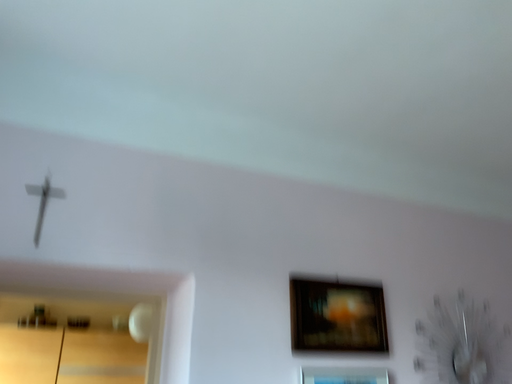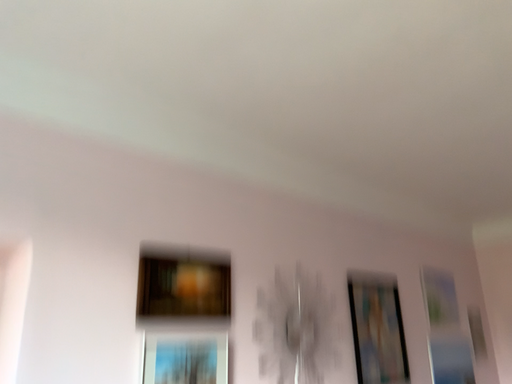
Question: How did the camera likely rotate when shooting the video?

Choices:
 (A) rotated left
 (B) rotated right

Answer: (B)